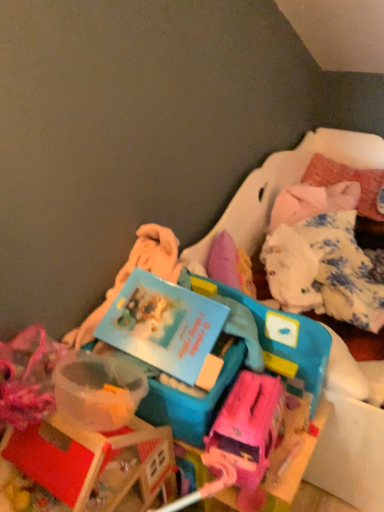
What is the approximate height of fluffy pink pillow at upper right?

fluffy pink pillow at upper right is 8.44 inches tall.

What is the approximate width of blue plastic storage box at center, which is counted as the 1th storage box, starting from the left?

blue plastic storage box at center, which is counted as the 1th storage box, starting from the left, is 15.53 inches wide.

Based on the photo, measure the distance between point (161, 396) and camera.

A distance of 3.38 feet exists between point (161, 396) and camera.

I want to click on fluffy pink pillow at upper right, so click(x=347, y=180).

Which is behind, blue plastic book at center or blue plastic storage box at center, which is counted as the 1th storage box, starting from the left?

blue plastic storage box at center, which is counted as the 1th storage box, starting from the left, is further away from the camera.

In terms of size, does blue plastic book at center appear bigger or smaller than blue plastic storage box at center, which is the second storage box in right-to-left order?

Considering their sizes, blue plastic book at center takes up less space than blue plastic storage box at center, which is the second storage box in right-to-left order.

From the image's perspective, which one is positioned higher, blue plastic book at center or blue plastic storage box at center, which is the second storage box in right-to-left order?

From the image's view, blue plastic book at center is above.

Can you confirm if blue plastic storage box at center, which ranks as the second storage box in left-to-right order, is thinner than fluffy pink pillow at upper right?

No.

Could you tell me if blue plastic storage box at center, which ranks as the second storage box in left-to-right order, is facing fluffy pink pillow at upper right?

No, blue plastic storage box at center, which ranks as the second storage box in left-to-right order, is not aimed at fluffy pink pillow at upper right.

From the image's perspective, which one is positioned lower, blue plastic storage box at center, which ranks as the 1th storage box in right-to-left order, or fluffy pink pillow at upper right?

blue plastic storage box at center, which ranks as the 1th storage box in right-to-left order, appears lower in the image.

Is blue plastic storage box at center, which ranks as the 1th storage box in right-to-left order, not close to fluffy pink pillow at upper right?

That's right, there is a large distance between blue plastic storage box at center, which ranks as the 1th storage box in right-to-left order, and fluffy pink pillow at upper right.

Is matte pink suitcase at center further to the viewer compared to blue plastic storage box at center, which ranks as the second storage box in left-to-right order?

No, matte pink suitcase at center is closer to the camera.

Would you say blue plastic storage box at center, which ranks as the second storage box in left-to-right order, is part of matte pink suitcase at center's contents?

No, blue plastic storage box at center, which ranks as the second storage box in left-to-right order, is not surrounded by matte pink suitcase at center.

Which object is thinner, matte pink suitcase at center or blue plastic storage box at center, which ranks as the 1th storage box in right-to-left order?

Thinner between the two is matte pink suitcase at center.

Does point (278, 398) appear closer or farther from the camera than point (183, 269)?

Point (278, 398) appears to be closer to the viewer than point (183, 269).

How far apart are matte pink suitcase at center and fluffy pink pillow at upper right?

A distance of 5.06 feet exists between matte pink suitcase at center and fluffy pink pillow at upper right.

From a real-world perspective, is matte pink suitcase at center positioned over fluffy pink pillow at upper right based on gravity?

Yes, from a real-world perspective, matte pink suitcase at center is on top of fluffy pink pillow at upper right.

Locate an element on the screen. toy that is above the fluffy pink pillow at upper right (from a real-world perspective) is located at coordinates (247, 433).

In terms of size, does matte pink suitcase at center appear bigger or smaller than fluffy pink pillow at upper right?

Clearly, matte pink suitcase at center is smaller in size than fluffy pink pillow at upper right.

Does point (208, 301) come closer to viewer compared to point (375, 202)?

That is True.

Is blue plastic book at center in contact with fluffy pink pillow at upper right?

blue plastic book at center and fluffy pink pillow at upper right are clearly separated.

Is blue plastic book at center wider or thinner than fluffy pink pillow at upper right?

In the image, blue plastic book at center appears to be more narrow than fluffy pink pillow at upper right.

From a real-world perspective, is blue plastic book at center physically below fluffy pink pillow at upper right?

Actually, blue plastic book at center is physically above fluffy pink pillow at upper right in the real world.

Considering the sizes of blue plastic storage box at center, which ranks as the second storage box in left-to-right order, and blue plastic storage box at center, which is the second storage box in right-to-left order, in the image, is blue plastic storage box at center, which ranks as the second storage box in left-to-right order, wider or thinner than blue plastic storage box at center, which is the second storage box in right-to-left order,?

Clearly, blue plastic storage box at center, which ranks as the second storage box in left-to-right order, has more width compared to blue plastic storage box at center, which is the second storage box in right-to-left order.

Considering the sizes of blue plastic storage box at center, which ranks as the second storage box in left-to-right order, and blue plastic storage box at center, which is the second storage box in right-to-left order, in the image, is blue plastic storage box at center, which ranks as the second storage box in left-to-right order, bigger or smaller than blue plastic storage box at center, which is the second storage box in right-to-left order,?

blue plastic storage box at center, which ranks as the second storage box in left-to-right order, is smaller than blue plastic storage box at center, which is the second storage box in right-to-left order.

From a real-world perspective, is blue plastic storage box at center, which ranks as the second storage box in left-to-right order, on blue plastic storage box at center, which is the second storage box in right-to-left order?

Correct, in the physical world, blue plastic storage box at center, which ranks as the second storage box in left-to-right order, is higher than blue plastic storage box at center, which is the second storage box in right-to-left order.

Could you tell me if blue plastic storage box at center, which ranks as the second storage box in left-to-right order, is facing blue plastic storage box at center, which is the second storage box in right-to-left order?

No, blue plastic storage box at center, which ranks as the second storage box in left-to-right order, is not oriented towards blue plastic storage box at center, which is the second storage box in right-to-left order.

From the image's perspective, which object appears higher, blue plastic storage box at center, which is counted as the 1th storage box, starting from the left, or fluffy pink pillow at upper right?

fluffy pink pillow at upper right appears higher in the image.

Starting from the fluffy pink pillow at upper right, which storage box is the 2nd one in front? Please provide its 2D coordinates.

[(189, 394)]

Looking at this image, considering the relative positions of blue plastic storage box at center, which is the second storage box in right-to-left order, and fluffy pink pillow at upper right in the image provided, is blue plastic storage box at center, which is the second storage box in right-to-left order, to the right of fluffy pink pillow at upper right from the viewer's perspective?

In fact, blue plastic storage box at center, which is the second storage box in right-to-left order, is to the left of fluffy pink pillow at upper right.

Locate an element on the screen. The height and width of the screenshot is (512, 384). the 1st storage box to the right of the blue plastic book at center, counting from the anchor's position is located at coordinates (189, 394).

Find the location of a particular element. The height and width of the screenshot is (512, 384). pillow that appears behind the blue plastic storage box at center, which ranks as the 1th storage box in right-to-left order is located at coordinates (347, 180).

From the image, which object appears to be farther from blue plastic storage box at center, which is the second storage box in right-to-left order, blue plastic storage box at center, which ranks as the 1th storage box in right-to-left order, or blue plastic book at center?

blue plastic storage box at center, which ranks as the 1th storage box in right-to-left order.

Looking at the image, which one is located further to blue plastic storage box at center, which ranks as the 1th storage box in right-to-left order, fluffy pink pillow at upper right or blue plastic book at center?

Among the two, fluffy pink pillow at upper right is located further to blue plastic storage box at center, which ranks as the 1th storage box in right-to-left order.

Which object lies nearer to the anchor point blue plastic storage box at center, which is counted as the 1th storage box, starting from the left, fluffy pink pillow at upper right or matte pink suitcase at center?

matte pink suitcase at center lies closer to blue plastic storage box at center, which is counted as the 1th storage box, starting from the left, than the other object.

Considering their positions, is matte pink suitcase at center positioned closer to fluffy pink pillow at upper right than blue plastic storage box at center, which is counted as the 1th storage box, starting from the left?

The object closer to fluffy pink pillow at upper right is matte pink suitcase at center.

From the image, which object appears to be farther from blue plastic storage box at center, which is the second storage box in right-to-left order, matte pink suitcase at center or blue plastic book at center?

Based on the image, matte pink suitcase at center appears to be further to blue plastic storage box at center, which is the second storage box in right-to-left order.

Estimate the real-world distances between objects in this image. Which object is closer to matte pink suitcase at center, blue plastic book at center or fluffy pink pillow at upper right?

blue plastic book at center is closer to matte pink suitcase at center.

Based on their spatial positions, is blue plastic book at center or blue plastic storage box at center, which ranks as the second storage box in left-to-right order, further from blue plastic storage box at center, which is the second storage box in right-to-left order?

blue plastic storage box at center, which ranks as the second storage box in left-to-right order.

Looking at the image, which one is located further to blue plastic storage box at center, which is the second storage box in right-to-left order, fluffy pink pillow at upper right or blue plastic storage box at center, which ranks as the second storage box in left-to-right order?

fluffy pink pillow at upper right is further to blue plastic storage box at center, which is the second storage box in right-to-left order.

You are a GUI agent. You are given a task and a screenshot of the screen. Output one action in this format:
    pyautogui.click(x=<x>, y=<y>)
    Task: Click on the storage box located between blue plastic book at center and blue plastic storage box at center, which ranks as the second storage box in left-to-right order, in the left-right direction
    The image size is (384, 512).
    Given the screenshot: What is the action you would take?
    click(189, 394)

Where is `storage box located between blue plastic storage box at center, which is the second storage box in right-to-left order, and matte pink suitcase at center in the left-right direction`? This screenshot has width=384, height=512. storage box located between blue plastic storage box at center, which is the second storage box in right-to-left order, and matte pink suitcase at center in the left-right direction is located at coordinates (279, 339).

Identify the location of storage box located between blue plastic storage box at center, which is counted as the 1th storage box, starting from the left, and fluffy pink pillow at upper right in the depth direction. (279, 339).

Identify the location of toy between blue plastic book at center and fluffy pink pillow at upper right from front to back. This screenshot has height=512, width=384. (247, 433).